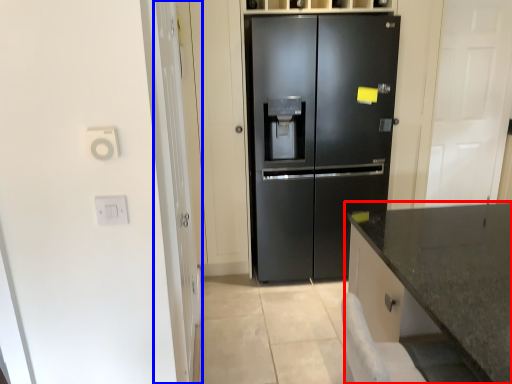
Question: Which of the following is the closest to the observer, countertop (highlighted by a red box) or glass door (highlighted by a blue box)?

Choices:
 (A) countertop
 (B) glass door

Answer: (A)